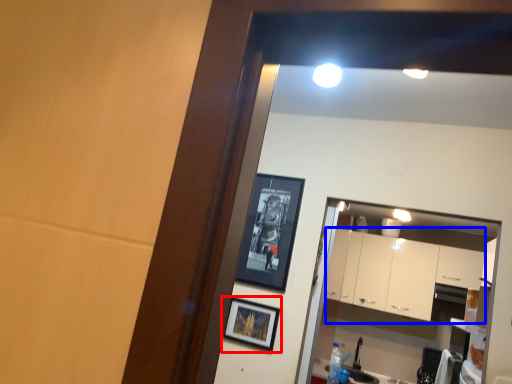
Question: Which point is further to the camera, picture frame (highlighted by a red box) or cabinetry (highlighted by a blue box)?

Choices:
 (A) picture frame
 (B) cabinetry

Answer: (B)